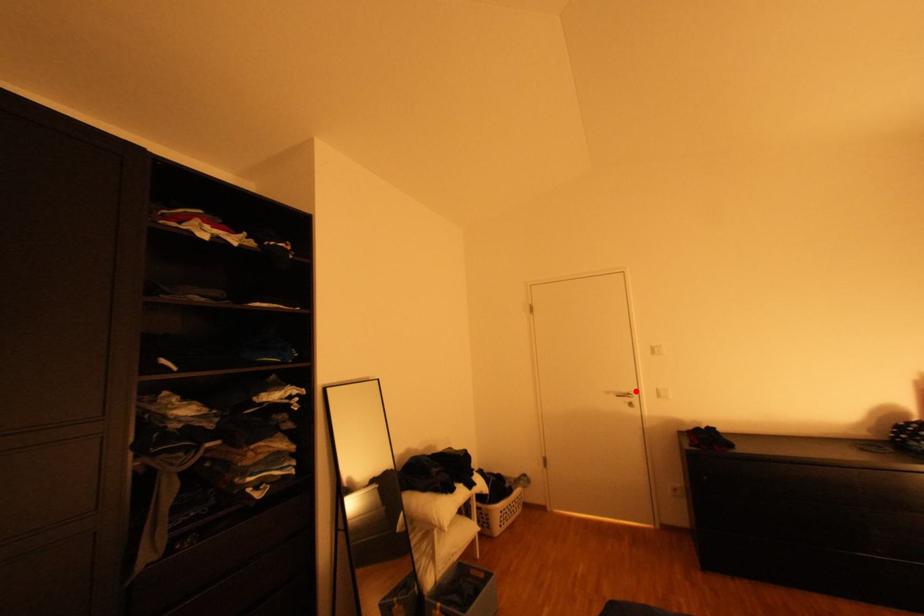
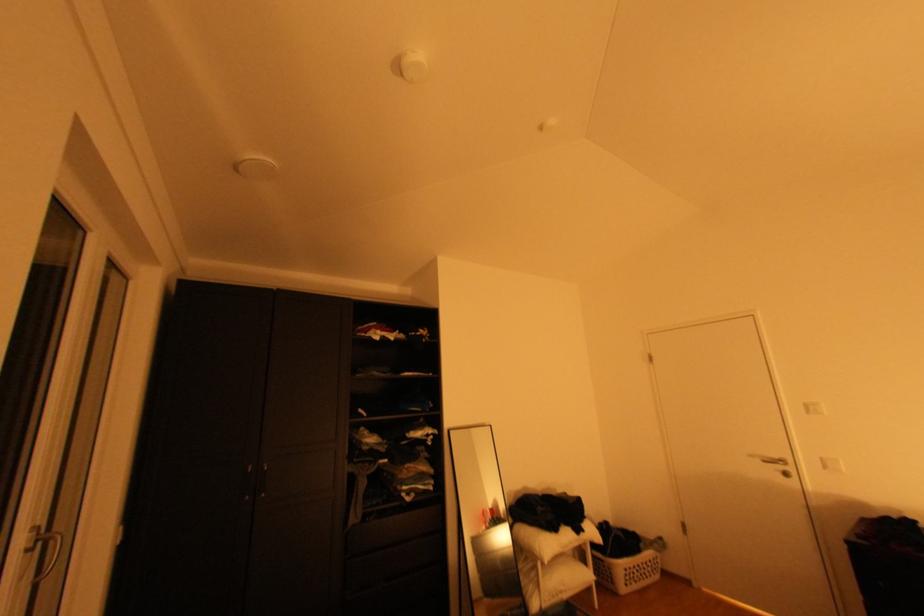
The point at the highlighted location is marked in the first image. Where is the corresponding point in the second image?

(786, 456)